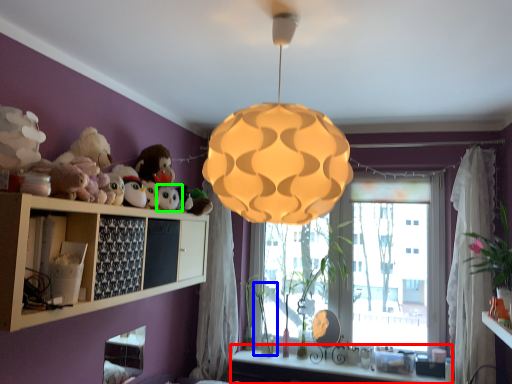
Question: Considering the real-world distances, which object is closest to vanity (highlighted by a red box)? plant (highlighted by a blue box) or toy (highlighted by a green box).

Choices:
 (A) plant
 (B) toy

Answer: (A)